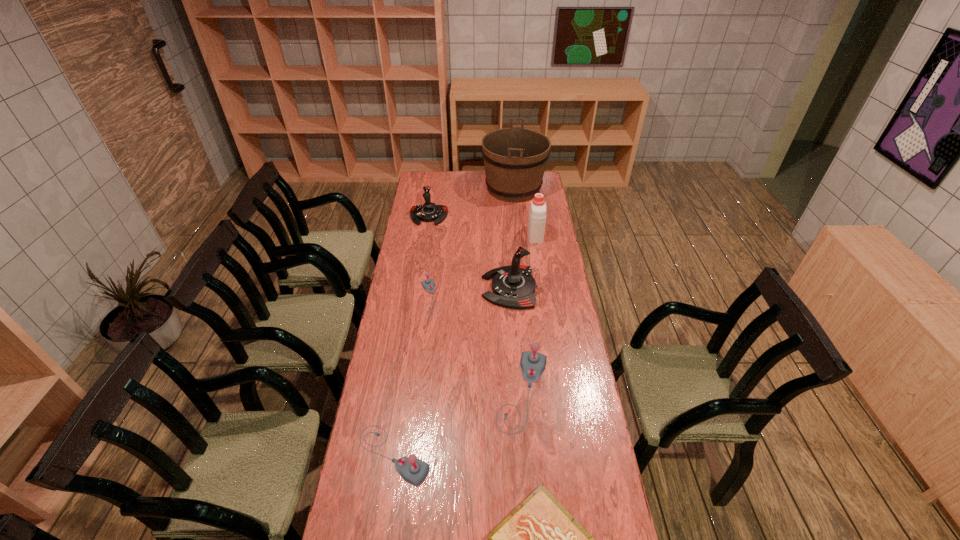
You are a GUI agent. You are given a task and a screenshot of the screen. Output one action in this format:
    pyautogui.click(x=<x>, y=<y>)
    Task: Click on the farthest object
    Image resolution: width=960 pixels, height=540 pixels.
    Given the screenshot: What is the action you would take?
    pyautogui.click(x=515, y=158)

What are the coordinates of `the tallest object` in the screenshot? It's located at (515, 158).

Where is `detergent`? This screenshot has height=540, width=960. detergent is located at coordinates tap(537, 215).

Where is `the tallest joystick`? The image size is (960, 540). the tallest joystick is located at coordinates (513, 286).

The height and width of the screenshot is (540, 960). I want to click on the bigger red joystick, so click(513, 286).

The image size is (960, 540). I want to click on the smaller red joystick, so click(x=429, y=212).

You are a GUI agent. You are given a task and a screenshot of the screen. Output one action in this format:
    pyautogui.click(x=<x>, y=<y>)
    Task: Click on the fourth shortest joystick
    
    Given the screenshot: What is the action you would take?
    (429, 212)

The height and width of the screenshot is (540, 960). Identify the location of the fifth tallest object. (532, 363).

This screenshot has height=540, width=960. Find the location of `the biggest gray joystick`. the biggest gray joystick is located at coordinates (532, 363).

Locate an element on the screen. This screenshot has width=960, height=540. the second biggest gray joystick is located at coordinates [413, 470].